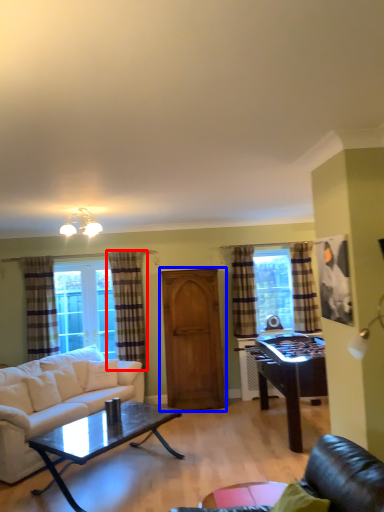
Question: Which of the following is the farthest to the observer, curtain (highlighted by a red box) or armoire (highlighted by a blue box)?

Choices:
 (A) curtain
 (B) armoire

Answer: (A)